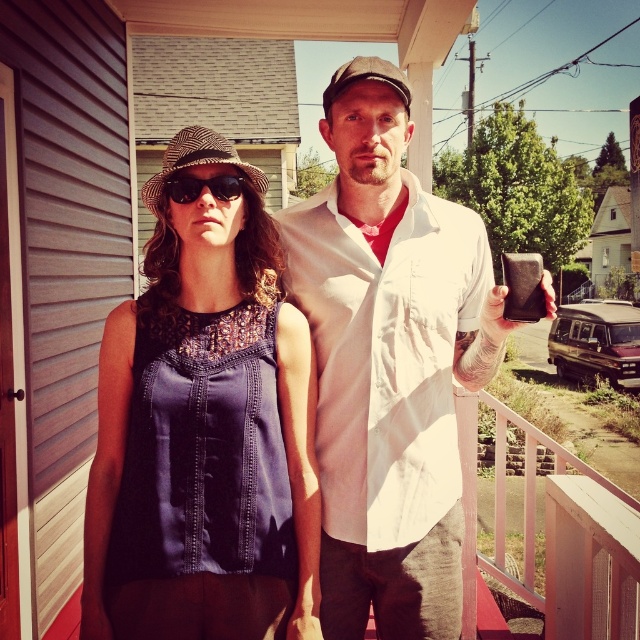
Question: Estimate the real-world distances between objects in this image. Which object is farther from the black textured sunglasses at center?

Choices:
 (A) white cotton shirt at center
 (B) matte blue dress at center

Answer: (A)

Question: In this image, where is white cotton shirt at center located relative to black textured sunglasses at center?

Choices:
 (A) left
 (B) right

Answer: (B)

Question: Which object appears closest to the camera in this image?

Choices:
 (A) black textured sunglasses at center
 (B) white cotton shirt at center

Answer: (B)

Question: Can you confirm if matte blue dress at center is thinner than white cotton shirt at center?

Choices:
 (A) no
 (B) yes

Answer: (B)

Question: Does matte blue dress at center appear over white cotton shirt at center?

Choices:
 (A) no
 (B) yes

Answer: (A)

Question: Which of the following is the closest to the observer?

Choices:
 (A) click(x=369, y=96)
 (B) click(x=193, y=177)
 (C) click(x=268, y=403)

Answer: (B)